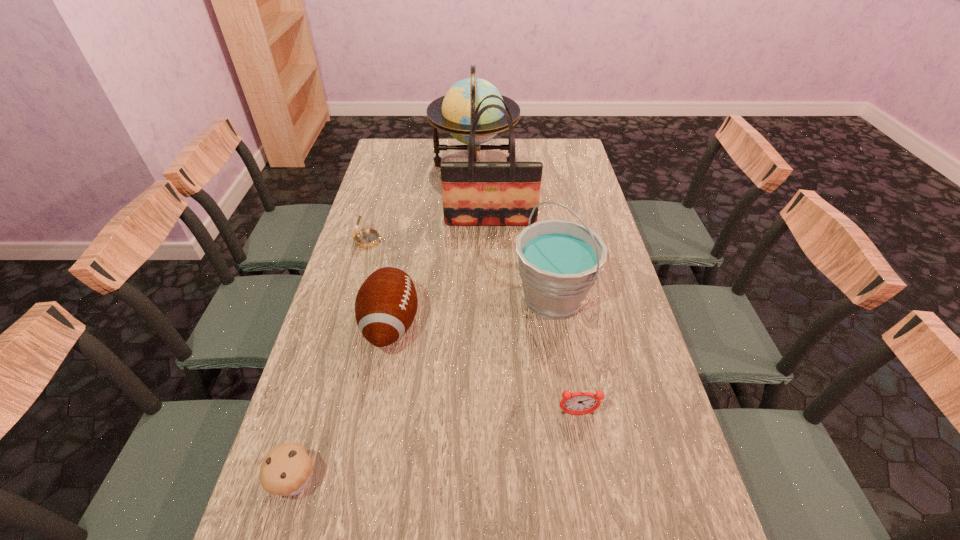
Find the location of a particular element. object that can be found as the fifth closest to the globe is located at coordinates (579, 403).